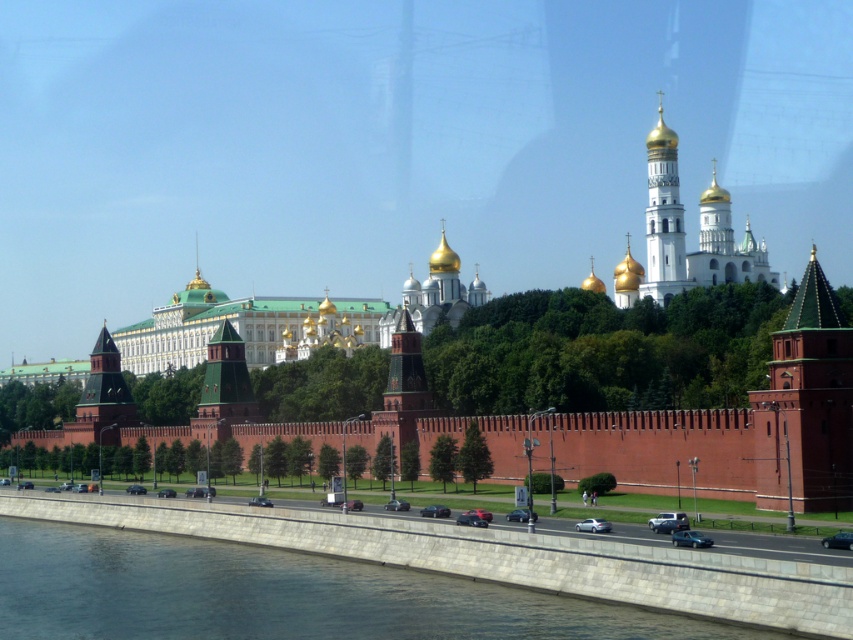
You are standing at the embankment near the Moskva River and want to take a photo of the white stone tower at upper center. If your camera can focus on objects up to 200 meters away, will you be able to capture a clear image of the tower?

The white stone tower at upper center is 157.04 meters away from the viewer. Since this distance is within the camera maximum focus range of 200 meters, the camera can focus on the tower and capture a clear image.

You are standing on the embankment of the Moskva River and see the Kremlin towers. Which tower is closer to you, the brick tower at right or the green wooden tower at center?

The brick tower at right is closer to you because it is in front of the green wooden tower at center.